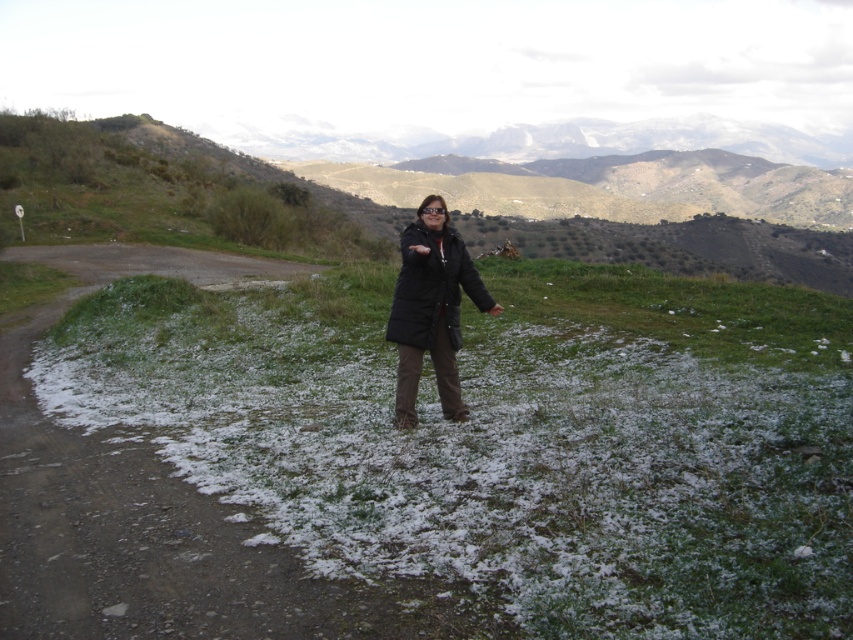
Does point (703, 380) lie behind point (459, 282)?

Yes, it is behind point (459, 282).

Who is positioned more to the left, white powdery snow at center or black matte jacket at center?

Positioned to the left is white powdery snow at center.

Which is in front, point (573, 369) or point (415, 323)?

Point (415, 323) is more forward.

You are a GUI agent. You are given a task and a screenshot of the screen. Output one action in this format:
    pyautogui.click(x=<x>, y=<y>)
    Task: Click on the white powdery snow at center
    The height and width of the screenshot is (640, 853).
    Given the screenshot: What is the action you would take?
    pyautogui.click(x=509, y=438)